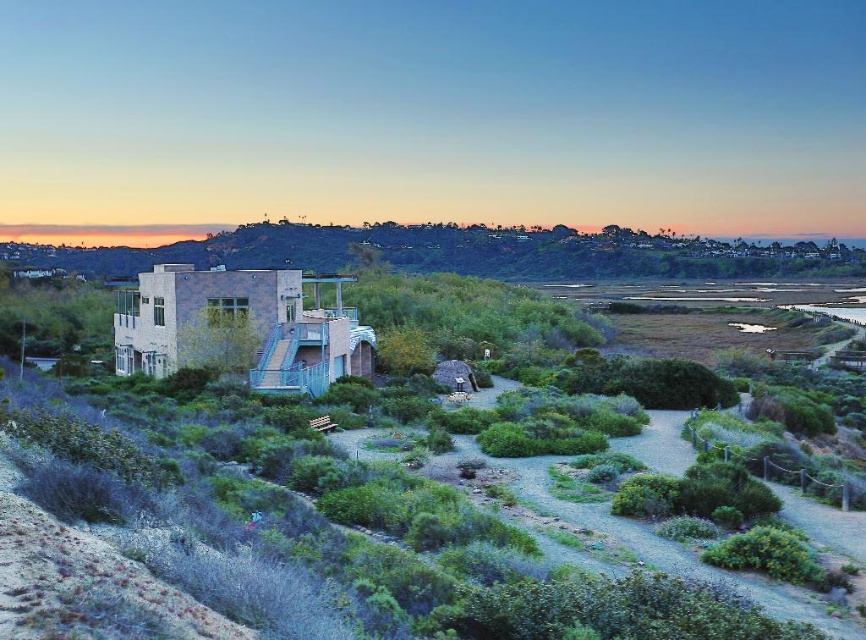
Is point (547, 589) less distant than point (236, 248)?

Yes, it is in front of point (236, 248).

Between green leafy shrubs at center and green grassy hillside at center, which one has more height?

green grassy hillside at center is taller.

Find the location of a particular element. The width and height of the screenshot is (866, 640). green leafy shrubs at center is located at coordinates (328, 529).